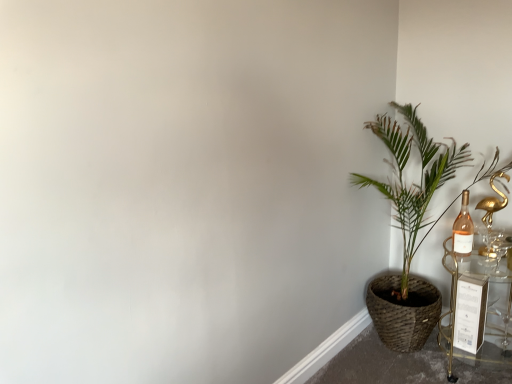
Question: From a real-world perspective, is gold metallic swan at right on top of green woven basket at right?

Choices:
 (A) no
 (B) yes

Answer: (B)

Question: Is green woven basket at right at the back of gold metallic swan at right?

Choices:
 (A) yes
 (B) no

Answer: (A)

Question: Is green woven basket at right located within gold metallic swan at right?

Choices:
 (A) yes
 (B) no

Answer: (B)

Question: Does gold metallic swan at right appear on the right side of green woven basket at right?

Choices:
 (A) no
 (B) yes

Answer: (B)

Question: Is gold metallic swan at right positioned beyond the bounds of green woven basket at right?

Choices:
 (A) yes
 (B) no

Answer: (B)

Question: Is green woven basket at right inside or outside of gold metallic table at right?

Choices:
 (A) inside
 (B) outside

Answer: (B)

Question: Would you say green woven basket at right is to the left or to the right of gold metallic table at right in the picture?

Choices:
 (A) left
 (B) right

Answer: (A)

Question: Considering the positions of green woven basket at right and gold metallic table at right in the image, is green woven basket at right taller or shorter than gold metallic table at right?

Choices:
 (A) short
 (B) tall

Answer: (B)

Question: Based on their sizes in the image, would you say green woven basket at right is bigger or smaller than gold metallic table at right?

Choices:
 (A) big
 (B) small

Answer: (A)

Question: From a real-world perspective, is green woven basket at right above or below gold metallic swan at right?

Choices:
 (A) below
 (B) above

Answer: (A)

Question: From the image's perspective, is green woven basket at right above or below gold metallic swan at right?

Choices:
 (A) below
 (B) above

Answer: (A)

Question: Is green woven basket at right bigger or smaller than gold metallic swan at right?

Choices:
 (A) small
 (B) big

Answer: (B)

Question: Relative to gold metallic swan at right, is green woven basket at right in front or behind?

Choices:
 (A) behind
 (B) front

Answer: (B)

Question: From the image's perspective, is green woven basket at right positioned above or below pink glass bottle at right?

Choices:
 (A) below
 (B) above

Answer: (A)

Question: Does point (425, 326) appear closer or farther from the camera than point (464, 256)?

Choices:
 (A) farther
 (B) closer

Answer: (A)